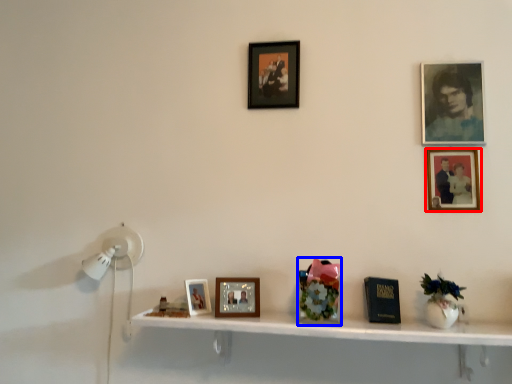
Question: Which object appears closest to the camera in this image, picture frame (highlighted by a red box) or art (highlighted by a blue box)?

Choices:
 (A) picture frame
 (B) art

Answer: (B)